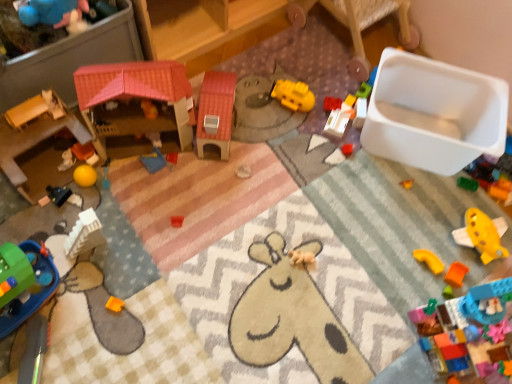
In order to click on free area in between green plastic toy at lower left, the fourteenth toy viewed from the right, and black plastic toy at lower left, the 13th toy from the right in this screenshot , I will do `click(52, 230)`.